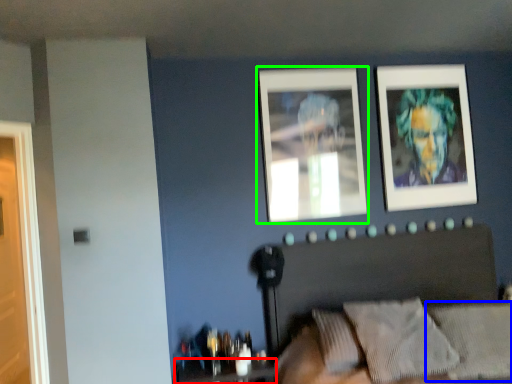
Question: Estimate the real-world distances between objects in this image. Which object is closer to table (highlighted by a red box), pillow (highlighted by a blue box) or picture frame (highlighted by a green box)?

Choices:
 (A) pillow
 (B) picture frame

Answer: (A)